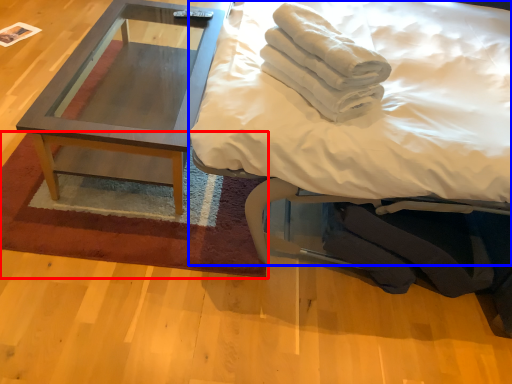
Question: Which of the following is the closest to the observer, mat (highlighted by a red box) or bed (highlighted by a blue box)?

Choices:
 (A) mat
 (B) bed

Answer: (B)